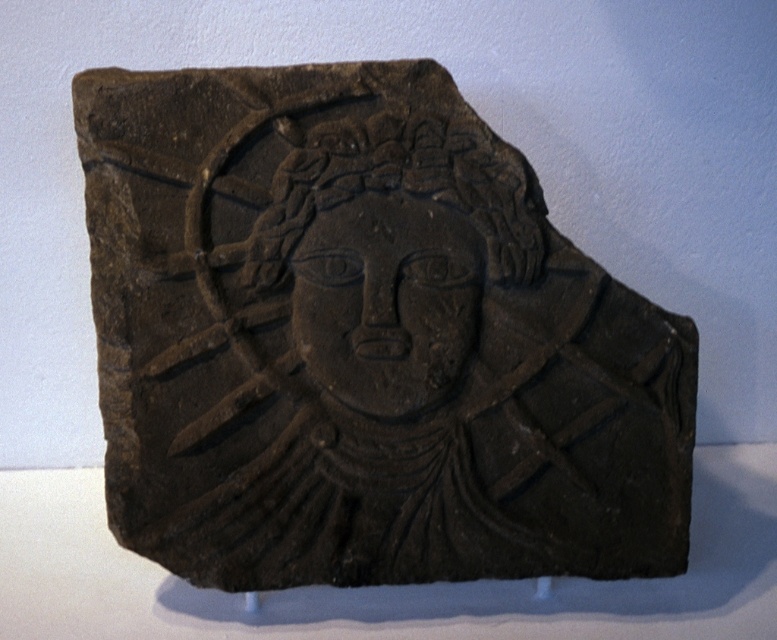
You are an archaeologist examining the ancient stone relief sculpture. You notice the dark stone carving at center and the matte black face at center. Which object is located above the other?

The matte black face at center is above the dark stone carving at center because the dark stone carving at center is positioned under it.

You are an archaeologist examining the ancient stone relief sculpture. You notice the dark stone carving at center and the matte black face at center. Which object is positioned further to the left?

The dark stone carving at center is positioned to the left of the matte black face at center, so it is further to the left.